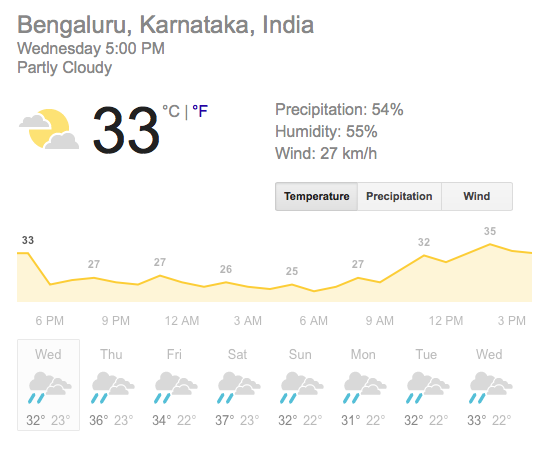
Locate an element on the screen. This screenshot has width=545, height=450. "temperature" button is located at coordinates (306, 194).